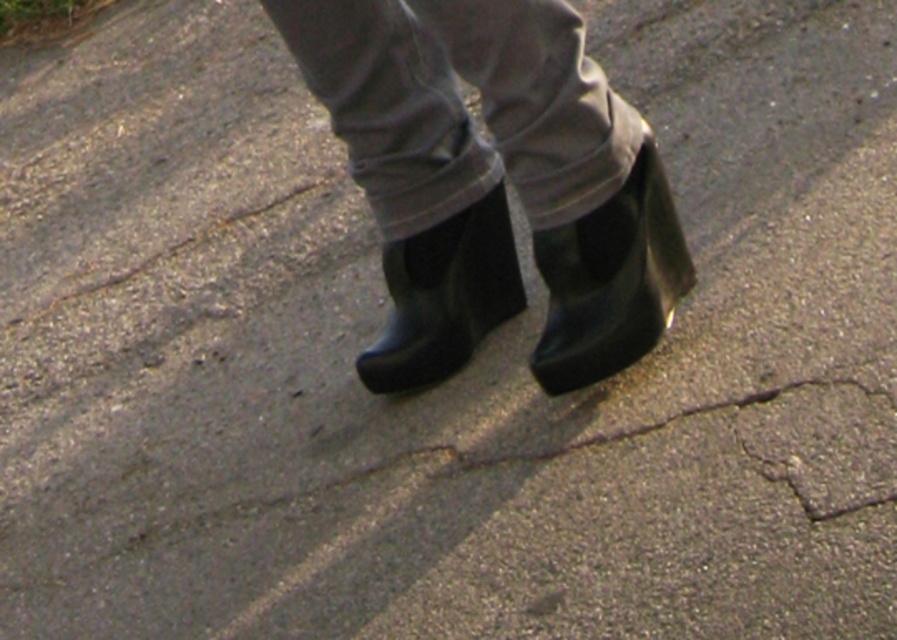
Who is shorter, rubber boots at center or black rubber boot at center?

black rubber boot at center is shorter.

Who is positioned more to the right, rubber boots at center or black rubber boot at center?

rubber boots at center is more to the right.

Is point (495, 129) more distant than point (448, 310)?

That is False.

The image size is (897, 640). I want to click on rubber boots at center, so click(x=493, y=180).

Is rubber boots at center closer to camera compared to rubber boot at center?

Yes.

Does rubber boots at center have a lesser height compared to rubber boot at center?

In fact, rubber boots at center may be taller than rubber boot at center.

Is point (411, 262) behind point (578, 241)?

That is True.

You are a GUI agent. You are given a task and a screenshot of the screen. Output one action in this format:
    pyautogui.click(x=<x>, y=<y>)
    Task: Click on the rubber boots at center
    
    Given the screenshot: What is the action you would take?
    493,180

Can you confirm if rubber boot at center is wider than black rubber boot at center?

No.

Is point (573, 364) closer to camera compared to point (447, 248)?

Yes.

Looking at this image, who is more forward, (x=655, y=336) or (x=495, y=232)?

Point (x=655, y=336)

The image size is (897, 640). In order to click on rubber boot at center in this screenshot , I will do `click(610, 280)`.